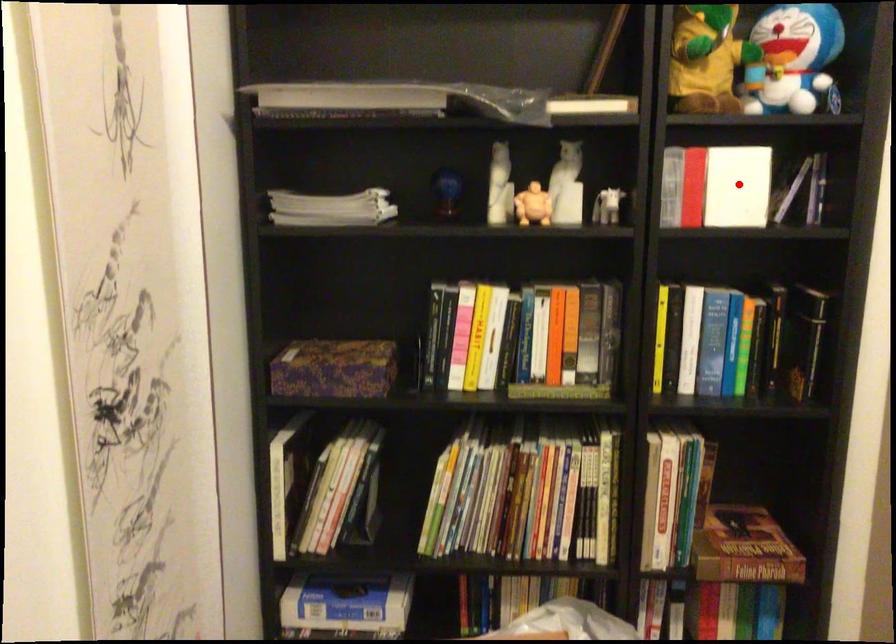
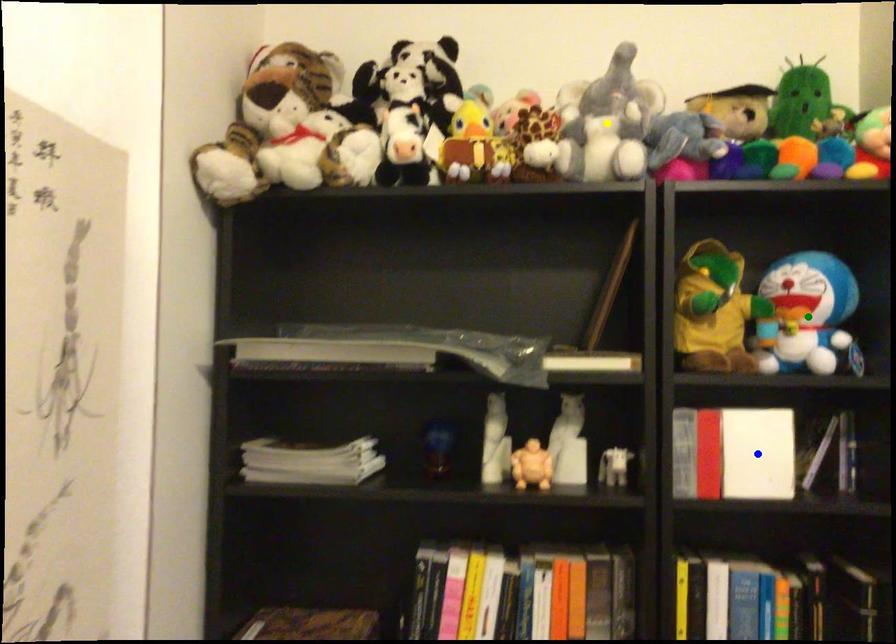
Question: I am providing you with two images of the same scene from different viewpoints. A red point is marked on the first image. You are given multiple points on the second image. Which mark in image 2 goes with the point in image 1?

Choices:
 (A) blue point
 (B) green point
 (C) yellow point

Answer: (A)